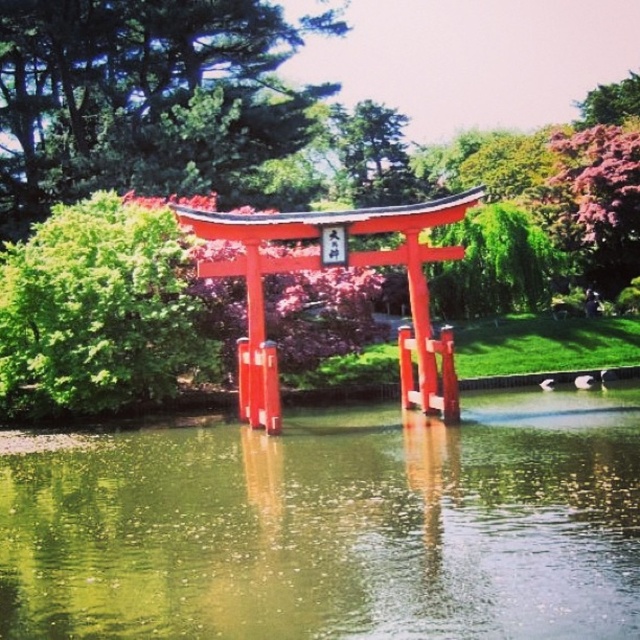
You are standing at the center of the torii gate in the Japanese garden scene. There are two points marked in the image, point A at coordinates point A is point (620,253) and point B at point B is point (593,104). Which point is closer to you?

Point A at coordinates point A is point (620,253) is closer to the viewer than point B at point B is point (593,104).

You are a visitor in the garden and want to take a photo of the green leafy tree at upper center and the purple leafy tree at upper right. Which tree is located higher up in the image?

The green leafy tree at upper center is positioned over the purple leafy tree at upper right, so it is higher up in the image.

You are a visitor standing at the entrance of the garden and see the green reflective water at center and the green leafy tree at upper center. Which object is positioned to the right of the other?

The green reflective water at center is to the right of the green leafy tree at upper center.